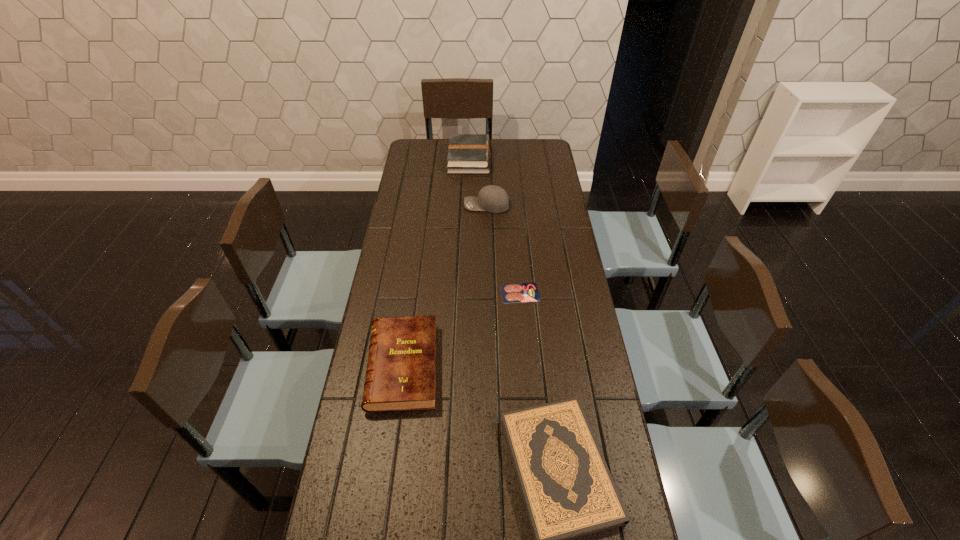
Locate an element on the screen. This screenshot has height=540, width=960. empty space between the farthest object and the salami is located at coordinates (494, 226).

This screenshot has width=960, height=540. In order to click on free area in between the farthest hardback book and the third nearest object in this screenshot , I will do `click(494, 226)`.

Find the location of `vacant point located between the farthest object and the third tallest object`. vacant point located between the farthest object and the third tallest object is located at coordinates (436, 263).

Point out which object is positioned as the fourth nearest to the tallest object. Please provide its 2D coordinates. Your answer should be formatted as a tuple, i.e. [(x, y)], where the tuple contains the x and y coordinates of a point satisfying the conditions above.

[(568, 492)]

Locate an element on the screen. This screenshot has width=960, height=540. the second closest object to the salami is located at coordinates (568, 492).

In order to click on hardback book that is the closest to the second shortest hardback book in this screenshot , I will do `click(568, 492)`.

Identify the location of the second closest hardback book relative to the shortest hardback book. Image resolution: width=960 pixels, height=540 pixels. coord(467,153).

At what (x,y) coordinates should I click in order to perform the action: click on vacant area that satisfies the following two spatial constraints: 1. on the spine side of the farthest hardback book; 2. on the front side of the second shortest hardback book. Please return your answer as a coordinate pair (x, y). This screenshot has width=960, height=540. Looking at the image, I should click on (463, 367).

This screenshot has height=540, width=960. I want to click on free space that satisfies the following two spatial constraints: 1. on the spine side of the third nearest object; 2. on the left side of the farthest hardback book, so click(465, 293).

You are a GUI agent. You are given a task and a screenshot of the screen. Output one action in this format:
    pyautogui.click(x=<x>, y=<y>)
    Task: Click on the vacant point that satisfies the following two spatial constraints: 1. on the front brim of the tallest object; 2. on the left side of the shortest object
    This screenshot has width=960, height=540.
    Given the screenshot: What is the action you would take?
    pyautogui.click(x=489, y=293)